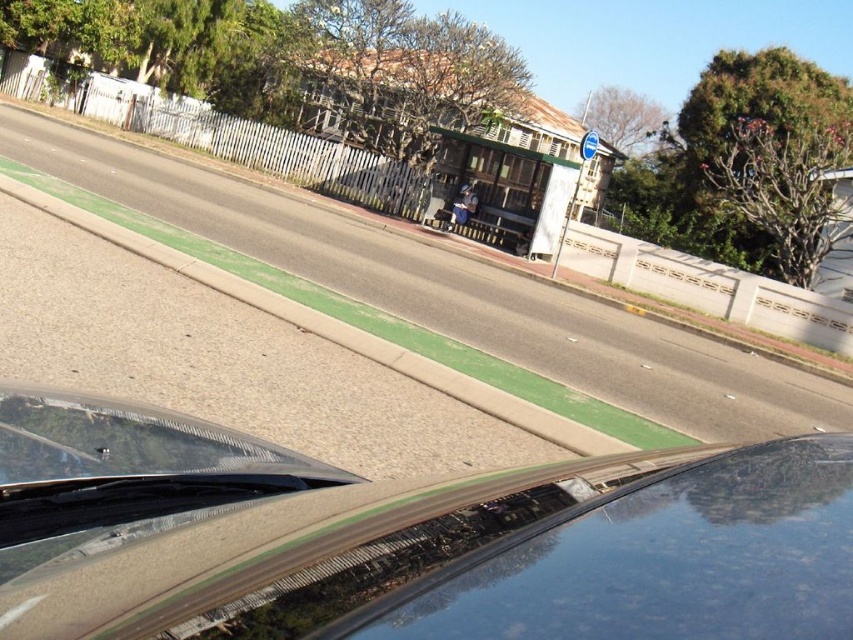
Does point (839, 620) lie behind point (630, 548)?

No, (839, 620) is closer to viewer.

Which is behind, point (0, 627) or point (485, 604)?

Positioned behind is point (0, 627).

Between point (675, 520) and point (848, 576), which one is positioned behind?

Positioned behind is point (675, 520).

The height and width of the screenshot is (640, 853). I want to click on glossy black car at center, so click(x=407, y=538).